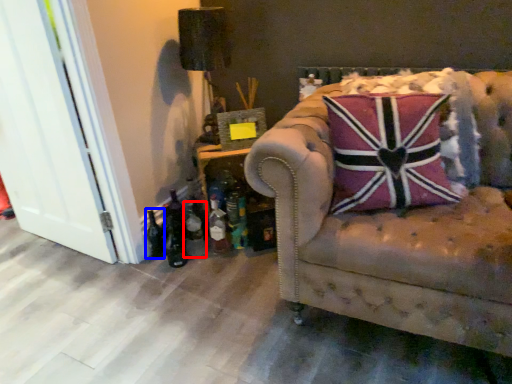
Question: Which object is further to the camera taking this photo, bottle (highlighted by a red box) or bottle (highlighted by a blue box)?

Choices:
 (A) bottle
 (B) bottle

Answer: (B)